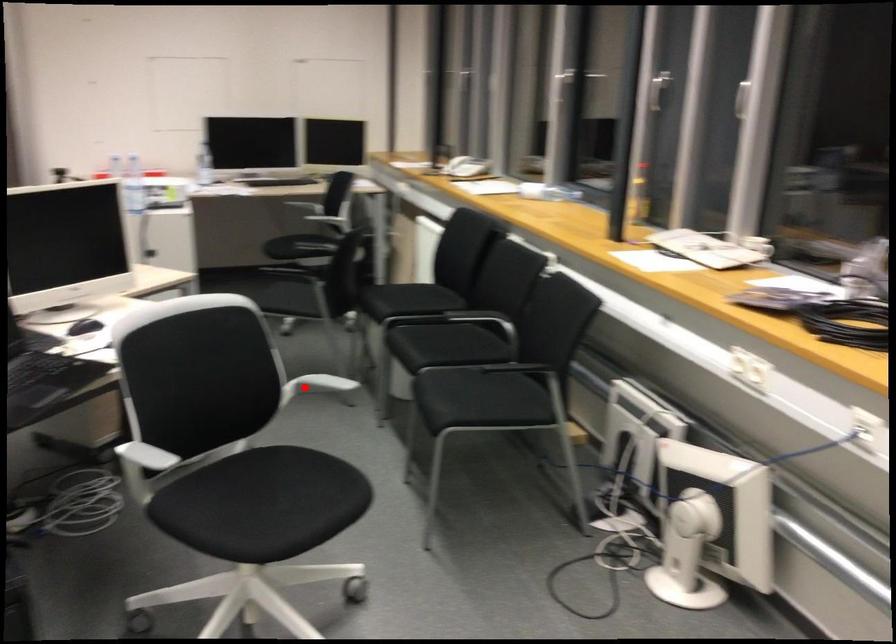
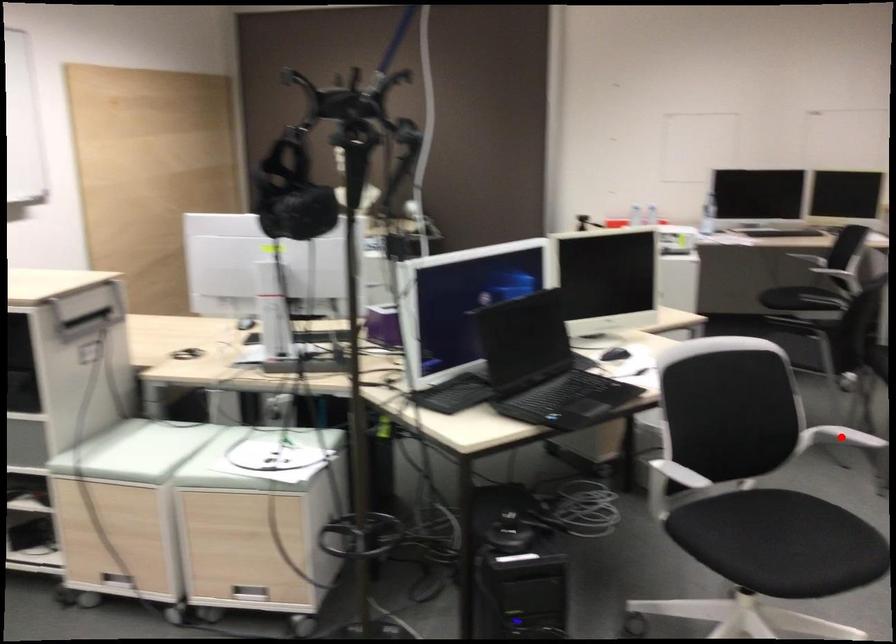
I am providing you with two images of the same scene from different viewpoints. A red point is marked on the first image and another point is marked on the second image. Is the red point in image1 aligned with the point shown in image2?

Yes